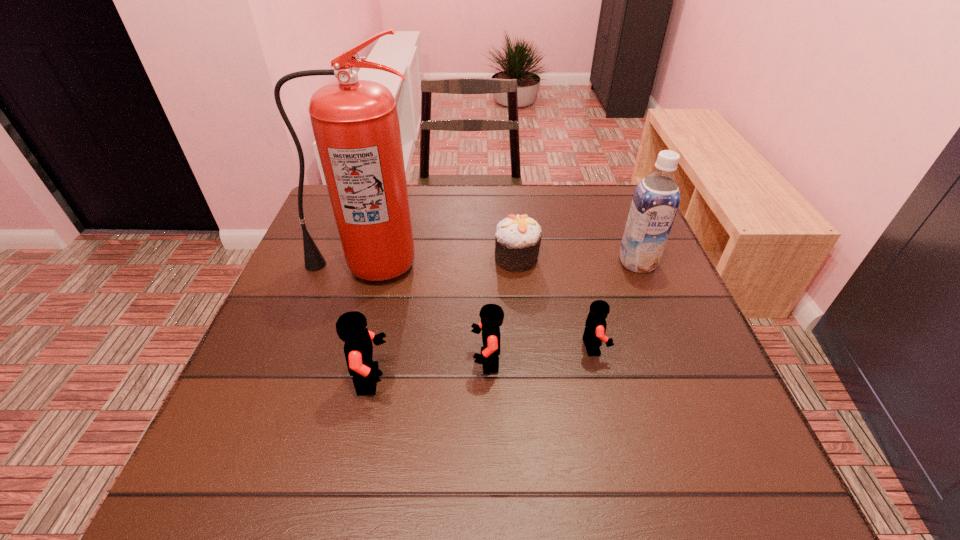
In the current image, all Legos are evenly spaced. To maintain this equal spacing, where should an additional Lego be placed on the right? Please point out a free spot. Please provide its 2D coordinates. Your answer should be formatted as a tuple, i.e. [(x, y)], where the tuple contains the x and y coordinates of a point satisfying the conditions above.

[(693, 331)]